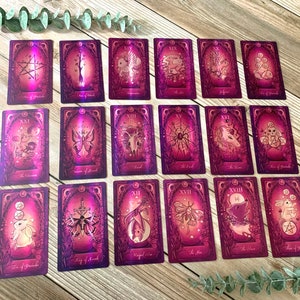
You are a GUI agent. You are given a task and a screenshot of the screen. Output one action in this format:
    pyautogui.click(x=<x>, y=<y>)
    Task: Click on the floor boards
    Image resolution: width=300 pixels, height=300 pixels.
    Given the screenshot: What is the action you would take?
    pyautogui.click(x=288, y=6), pyautogui.click(x=252, y=17), pyautogui.click(x=156, y=30), pyautogui.click(x=65, y=37), pyautogui.click(x=5, y=76), pyautogui.click(x=52, y=213), pyautogui.click(x=42, y=284)